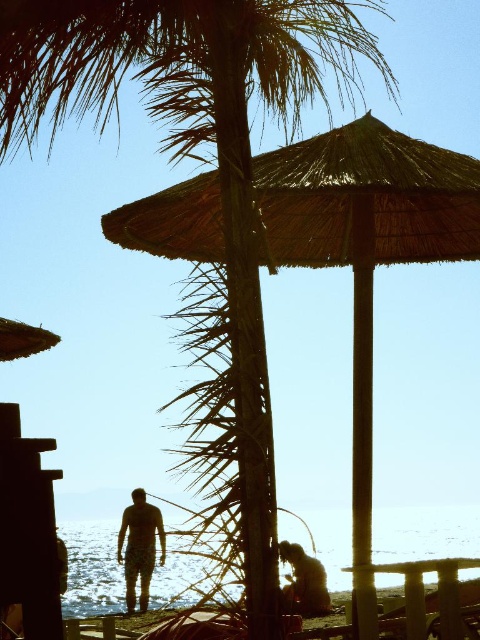
You are a photographer trying to capture the brown fur cat at lower center under the thatched straw umbrella at center. Can the umbrella provide shade for the cat given their sizes?

The thatched straw umbrella at center is not as tall as the brown fur cat at lower center, so the umbrella may not provide sufficient shade for the cat since it is shorter than the cat.

You are a photographer trying to capture a photo of the brown fur cat at lower center without any obstructions. Given the current setup, will the thatched straw umbrella at center block your view of the cat?

The brown fur cat at lower center is behind the thatched straw umbrella at center, so the umbrella will block your view of the cat.

You are standing on the beach and see the camouflage pants at center and the brown fur cat at lower center. Which object is closer to you?

The camouflage pants at center is closer to you because it is further to the viewer than the brown fur cat at lower center.